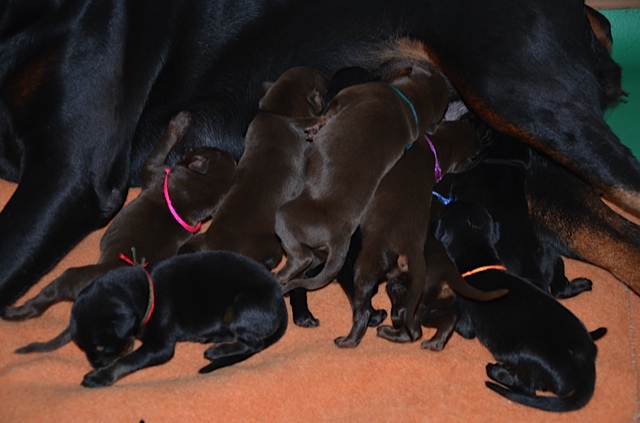
Locate an element on the screen. This screenshot has height=423, width=640. floor is located at coordinates coord(406,386).